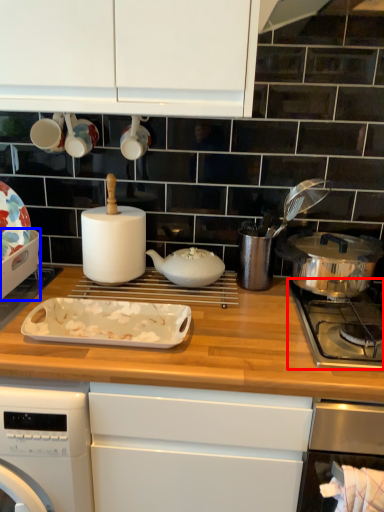
Question: Which point is closer to the camera, gas stove (highlighted by a red box) or kitchen appliance (highlighted by a blue box)?

Choices:
 (A) gas stove
 (B) kitchen appliance

Answer: (A)